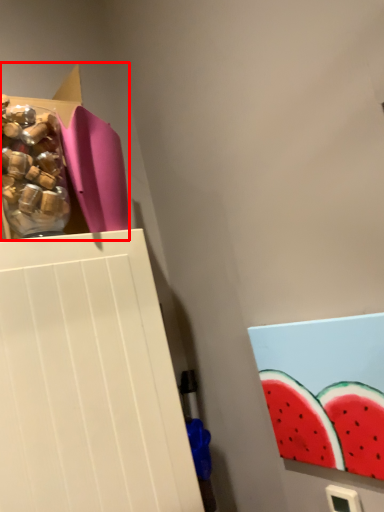
Question: Observing the image, what is the correct spatial positioning of storage box (annotated by the red box) in reference to food?

Choices:
 (A) right
 (B) left

Answer: (A)